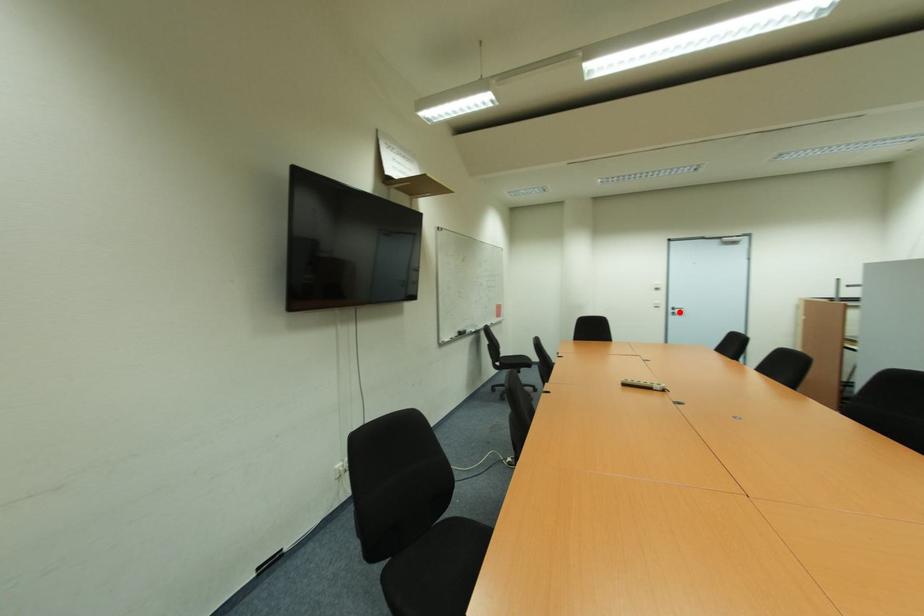
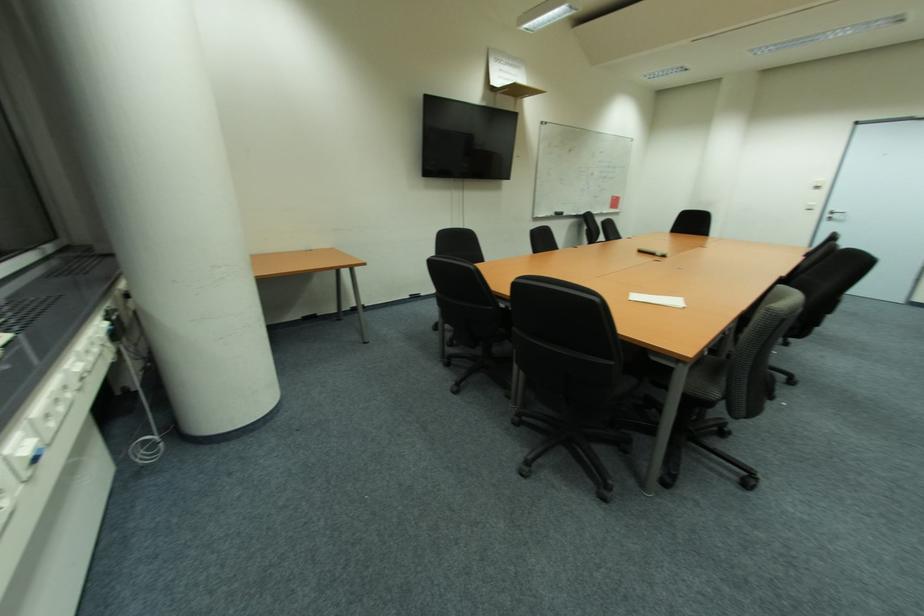
Question: I am providing you with two images of the same scene from different viewpoints. Given a red point in image1, look at the same physical point in image2. Is it:

Choices:
 (A) Closer to the viewpoint
 (B) Farther from the viewpoint

Answer: (B)